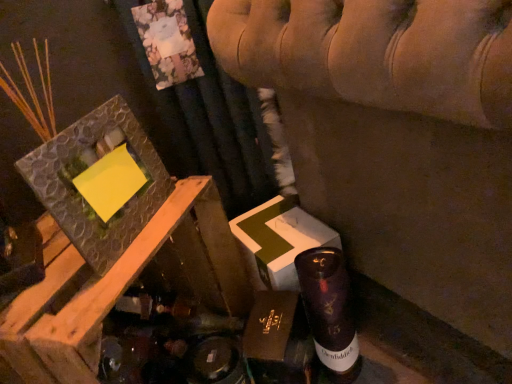
Question: Is textured stone picture frame at upper left closer to camera compared to velvet beige sofa at upper center?

Choices:
 (A) no
 (B) yes

Answer: (A)

Question: Is velvet beige sofa at upper center a part of textured stone picture frame at upper left?

Choices:
 (A) yes
 (B) no

Answer: (B)

Question: Considering the relative sizes of textured stone picture frame at upper left and velvet beige sofa at upper center in the image provided, is textured stone picture frame at upper left shorter than velvet beige sofa at upper center?

Choices:
 (A) no
 (B) yes

Answer: (B)

Question: From the image's perspective, is textured stone picture frame at upper left located beneath velvet beige sofa at upper center?

Choices:
 (A) no
 (B) yes

Answer: (B)

Question: Is textured stone picture frame at upper left taller than velvet beige sofa at upper center?

Choices:
 (A) yes
 (B) no

Answer: (B)

Question: Is textured stone picture frame at upper left located outside velvet beige sofa at upper center?

Choices:
 (A) no
 (B) yes

Answer: (B)

Question: Is textured stone picture frame at upper left a part of velvet beige sofa at upper center?

Choices:
 (A) no
 (B) yes

Answer: (A)

Question: From the image's perspective, is velvet beige sofa at upper center below textured stone picture frame at upper left?

Choices:
 (A) no
 (B) yes

Answer: (A)

Question: Is velvet beige sofa at upper center behind textured stone picture frame at upper left?

Choices:
 (A) no
 (B) yes

Answer: (A)

Question: Does velvet beige sofa at upper center appear on the right side of textured stone picture frame at upper left?

Choices:
 (A) yes
 (B) no

Answer: (A)

Question: From the image's perspective, is velvet beige sofa at upper center located above textured stone picture frame at upper left?

Choices:
 (A) no
 (B) yes

Answer: (B)

Question: Is velvet beige sofa at upper center oriented away from textured stone picture frame at upper left?

Choices:
 (A) yes
 (B) no

Answer: (B)

Question: Is the position of shiny purple glass bottle at lower right more distant than that of velvet beige sofa at upper center?

Choices:
 (A) yes
 (B) no

Answer: (A)